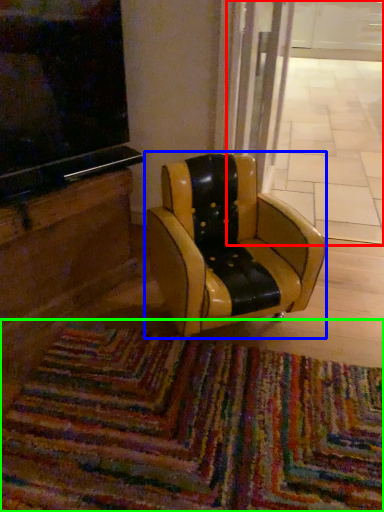
Question: Which is nearer to the shop window (highlighted by a red box)? chair (highlighted by a blue box) or mat (highlighted by a green box).

Choices:
 (A) chair
 (B) mat

Answer: (A)